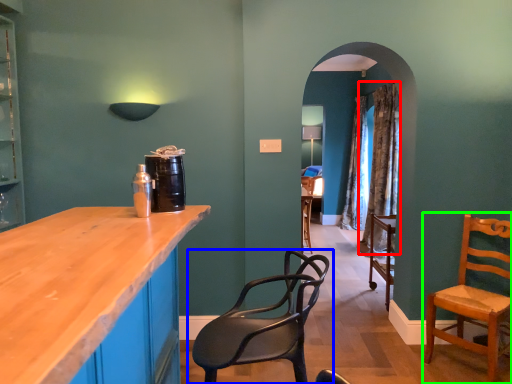
Question: Which is nearer to the curtain (highlighted by a red box)? chair (highlighted by a blue box) or chair (highlighted by a green box).

Choices:
 (A) chair
 (B) chair

Answer: (B)